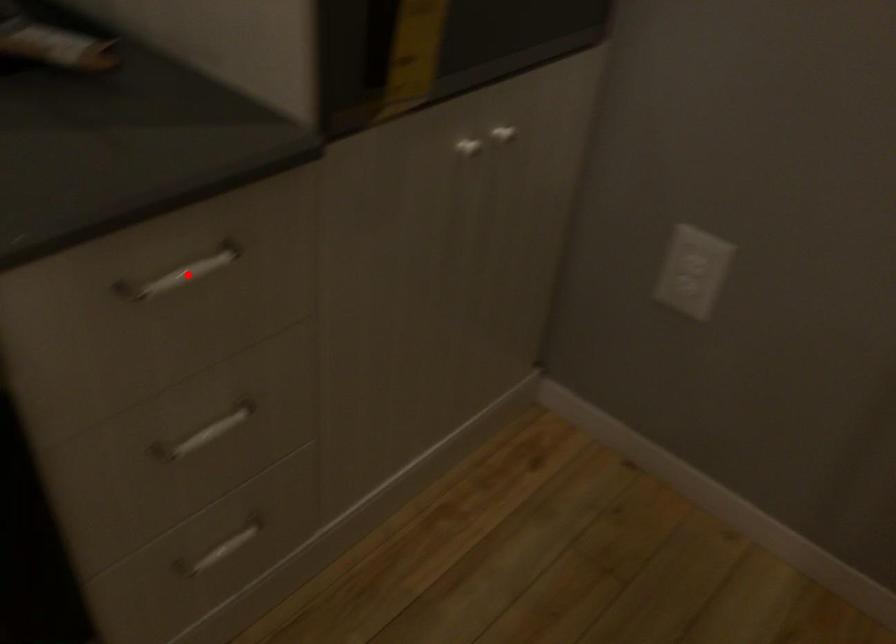
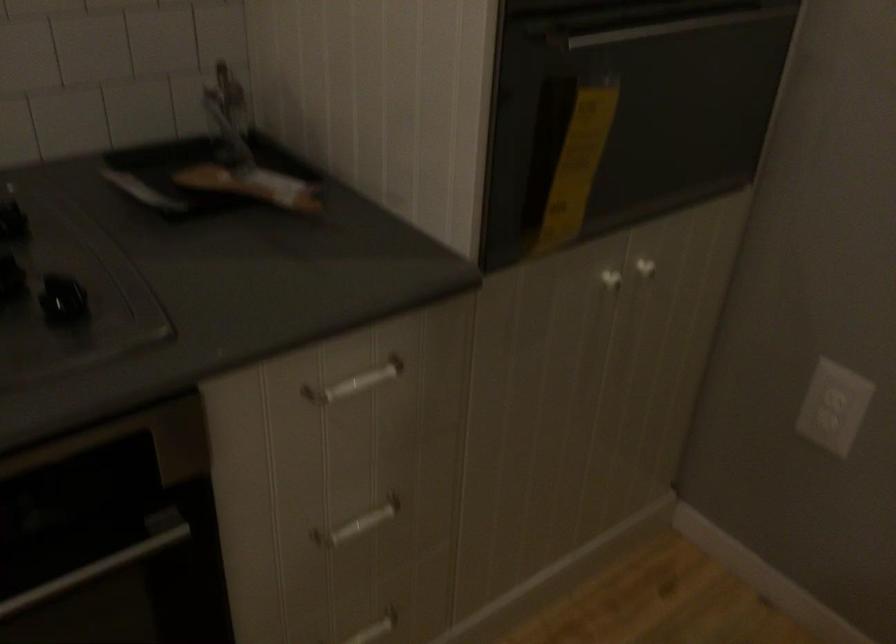
Question: I am providing you with two images of the same scene from different viewpoints. Given a red point in image1, look at the same physical point in image2. Is it:

Choices:
 (A) Closer to the viewpoint
 (B) Farther from the viewpoint

Answer: (B)